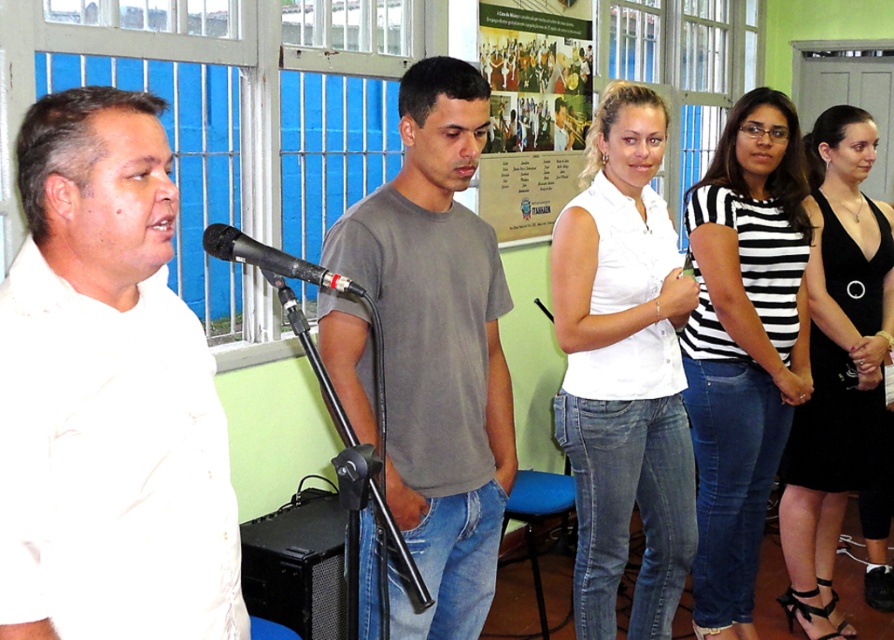
Question: Can you confirm if white matte shirt at left is wider than white cotton shirt at center?

Choices:
 (A) no
 (B) yes

Answer: (A)

Question: Among these points, which one is farthest from the camera?

Choices:
 (A) (496, 112)
 (B) (420, 428)
 (C) (702, 540)

Answer: (A)

Question: Where is white cotton shirt at center located in relation to black and white striped shirt at center in the image?

Choices:
 (A) above
 (B) below

Answer: (A)

Question: Is gray matte t-shirt at center to the right of white cotton shirt at center from the viewer's perspective?

Choices:
 (A) no
 (B) yes

Answer: (A)

Question: Among these objects, which one is farthest from the camera?

Choices:
 (A) black and white striped shirt at center
 (B) gray matte t-shirt at center

Answer: (A)

Question: Which point is closer to the camera taking this photo?

Choices:
 (A) (257, 243)
 (B) (415, 100)

Answer: (A)